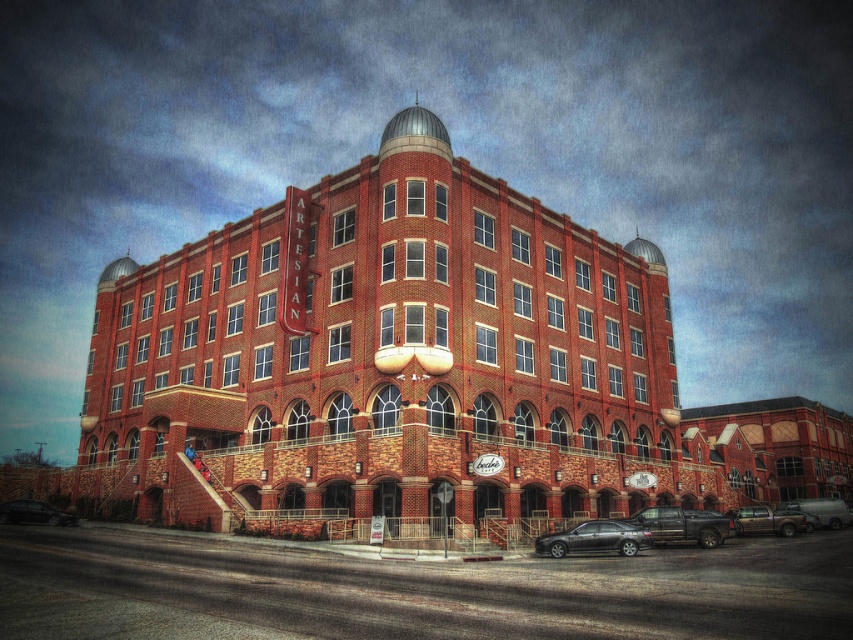
Is metallic silver pickup truck at center to the right of brown matte truck at lower right from the viewer's perspective?

In fact, metallic silver pickup truck at center is to the left of brown matte truck at lower right.

Between metallic silver pickup truck at center and brown matte truck at lower right, which one has less height?

Standing shorter between the two is brown matte truck at lower right.

Does point (708, 538) lie in front of point (787, 524)?

Yes, point (708, 538) is closer to viewer.

Locate an element on the screen. Image resolution: width=853 pixels, height=640 pixels. metallic silver pickup truck at center is located at coordinates (683, 524).

Can you confirm if red brick building at center is positioned below shiny black sedan at lower left?

No.

In the scene shown: Does red brick building at center appear over shiny black sedan at lower left?

Indeed, red brick building at center is positioned over shiny black sedan at lower left.

Is point (618, 244) farther from viewer compared to point (32, 500)?

Yes.

Where is `red brick building at center`? This screenshot has height=640, width=853. red brick building at center is located at coordinates (393, 356).

Can you confirm if brick building at lower right is positioned below metallic silver truck at lower right?

No.

Which is more to the left, brick building at lower right or metallic silver truck at lower right?

metallic silver truck at lower right

Is point (763, 492) positioned before point (796, 499)?

Yes, point (763, 492) is in front of point (796, 499).

Locate an element on the screen. The image size is (853, 640). brick building at lower right is located at coordinates (784, 444).